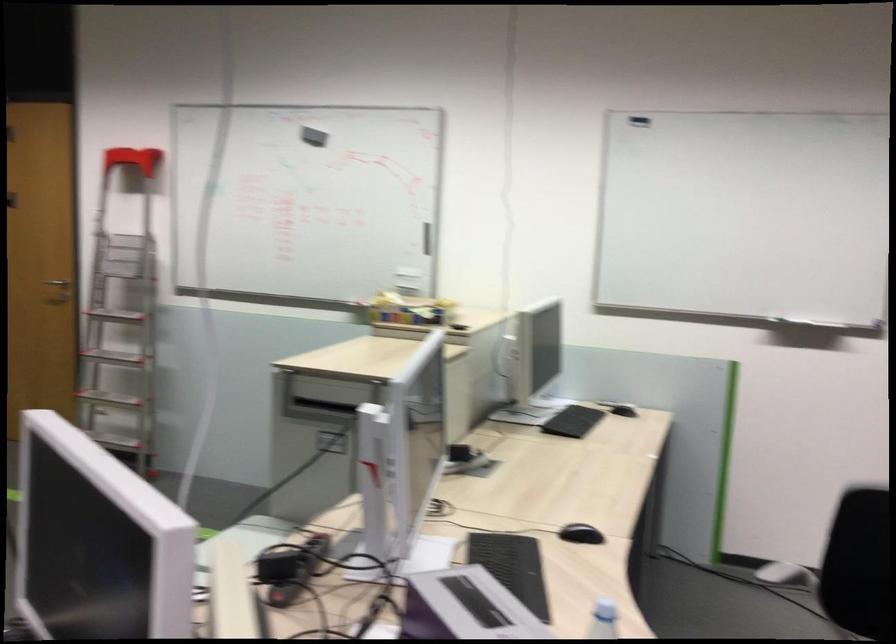
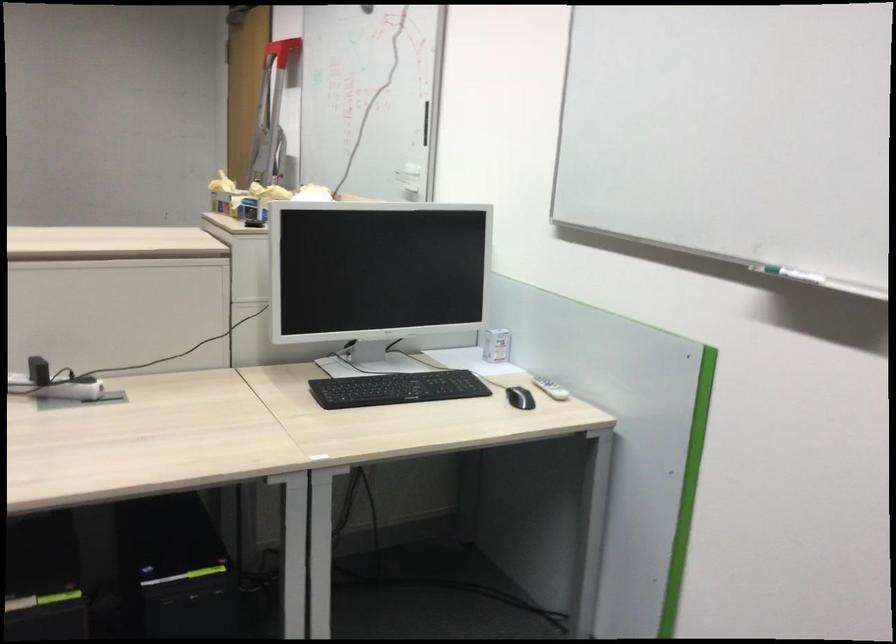
The point at [626,402] is marked in the first image. Where is the corresponding point in the second image?

(550, 388)